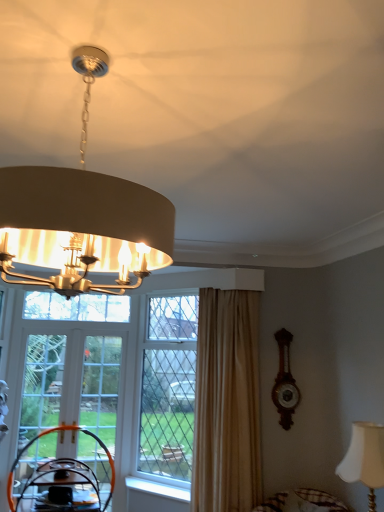
Question: From the image's perspective, is white painted wood at lower center above or below white fabric lampshade at lower right, which is the second lamp from left to right?

Choices:
 (A) below
 (B) above

Answer: (A)

Question: Would you say white painted wood at lower center is inside or outside white fabric lampshade at lower right, which is the second lamp from left to right?

Choices:
 (A) inside
 (B) outside

Answer: (B)

Question: Which is nearer to the clear glass screen door at center, placed as the second screen door when sorted from left to right?

Choices:
 (A) clear glass door at lower left, the first screen door from the left
 (B) matte beige lampshade at upper center, the 1th lamp from the front
 (C) white fabric lampshade at lower right, which ranks as the 1th lamp in back-to-front order
 (D) orange plastic swivel chair at lower left
 (E) beige fabric curtain at right

Answer: (A)

Question: Based on their relative distances, which object is nearer to the white fabric lampshade at lower right, which is the second lamp from top to bottom?

Choices:
 (A) wooden round table at lower left
 (B) matte beige lampshade at upper center, the 1th lamp in the left-to-right sequence
 (C) clear glass window at center
 (D) clear glass door at lower left, the first screen door from the left
 (E) wooden clock at right

Answer: (E)